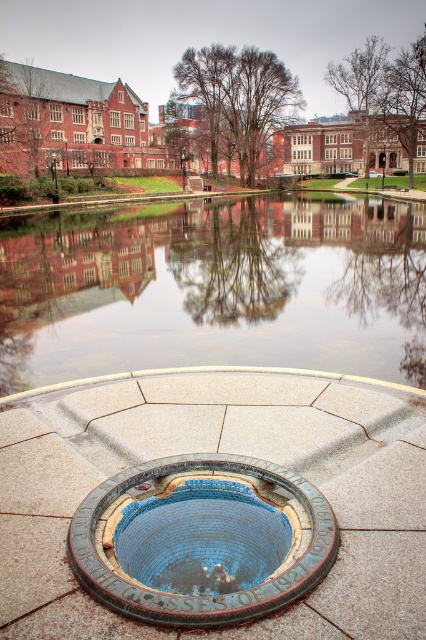
Which is behind, point (176, 380) or point (40, 266)?

Positioned behind is point (40, 266).

Can you confirm if blue mosaic tile at center is thinner than reflective glass lake at center?

Correct, blue mosaic tile at center's width is less than reflective glass lake at center's.

Between point (334, 592) and point (169, 269), which one is positioned behind?

Point (169, 269)

Where is `blue mosaic tile at center`? blue mosaic tile at center is located at coordinates (219, 451).

Does reflective glass lake at center appear over blue mosaic pool at center?

Yes.

The width and height of the screenshot is (426, 640). Describe the element at coordinates (215, 288) in the screenshot. I see `reflective glass lake at center` at that location.

Where is `reflective glass lake at center`? reflective glass lake at center is located at coordinates (215, 288).

I want to click on reflective glass lake at center, so click(215, 288).

Does point (414, 513) lie behind point (169, 582)?

Yes, point (414, 513) is farther from viewer.

Between blue mosaic tile at center and blue mosaic pool at center, which one appears on the left side from the viewer's perspective?

blue mosaic tile at center is more to the left.

Which is in front, point (370, 429) or point (160, 600)?

Positioned in front is point (160, 600).

Image resolution: width=426 pixels, height=640 pixels. I want to click on blue mosaic tile at center, so click(219, 451).